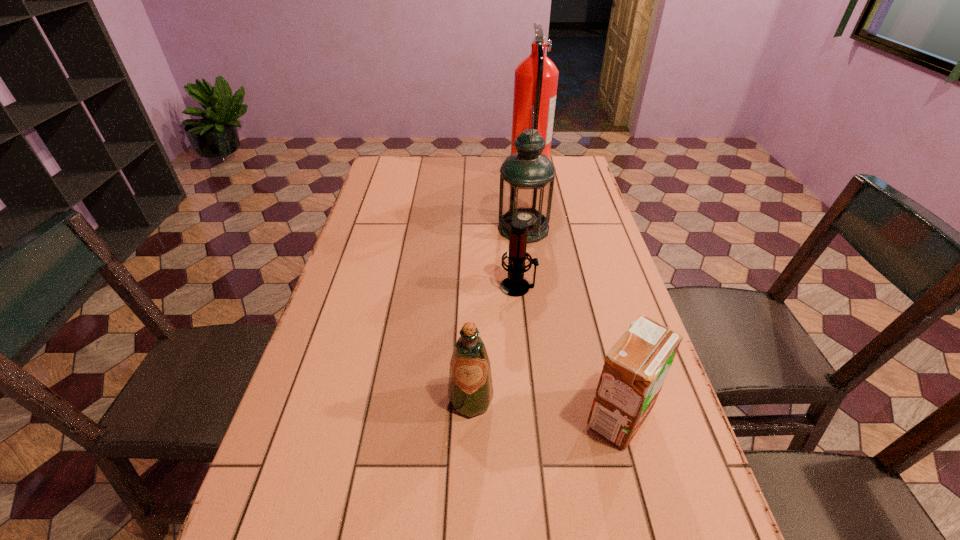
Where is `the farthest object`? The height and width of the screenshot is (540, 960). the farthest object is located at coordinates (536, 78).

Image resolution: width=960 pixels, height=540 pixels. Identify the location of fire extinguisher. (536, 78).

Where is `oil lamp`? oil lamp is located at coordinates (527, 177).

Where is `the second tallest object`? The image size is (960, 540). the second tallest object is located at coordinates tap(527, 177).

I want to click on carton, so click(x=635, y=369).

Identify the location of olive oil. (470, 391).

The height and width of the screenshot is (540, 960). In order to click on the third farthest object in this screenshot , I will do `click(515, 286)`.

This screenshot has width=960, height=540. Identify the location of blank space located at the nozzle of the fire extinguisher. (479, 170).

Find the location of `vacant space located 0.140m at the nozzle of the fire extinguisher`. vacant space located 0.140m at the nozzle of the fire extinguisher is located at coordinates (474, 170).

This screenshot has width=960, height=540. I want to click on vacant region located 0.060m at the nozzle of the fire extinguisher, so click(x=494, y=170).